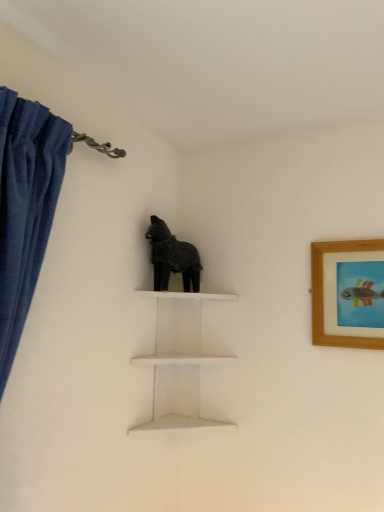
Question: Is the position of fuzzy black dog at center less distant than that of wooden framed picture at upper right?

Choices:
 (A) no
 (B) yes

Answer: (A)

Question: Considering the relative positions of fuzzy black dog at center and wooden framed picture at upper right in the image provided, is fuzzy black dog at center to the right of wooden framed picture at upper right from the viewer's perspective?

Choices:
 (A) no
 (B) yes

Answer: (A)

Question: From the image's perspective, is fuzzy black dog at center beneath wooden framed picture at upper right?

Choices:
 (A) no
 (B) yes

Answer: (A)

Question: Are fuzzy black dog at center and wooden framed picture at upper right located far from each other?

Choices:
 (A) yes
 (B) no

Answer: (B)

Question: Considering the relative sizes of fuzzy black dog at center and wooden framed picture at upper right in the image provided, is fuzzy black dog at center shorter than wooden framed picture at upper right?

Choices:
 (A) yes
 (B) no

Answer: (A)

Question: From their relative heights in the image, would you say wooden framed picture at upper right is taller or shorter than fuzzy black dog at center?

Choices:
 (A) short
 (B) tall

Answer: (B)

Question: Considering their positions, is wooden framed picture at upper right located in front of or behind fuzzy black dog at center?

Choices:
 (A) behind
 (B) front

Answer: (B)

Question: Is wooden framed picture at upper right spatially inside fuzzy black dog at center, or outside of it?

Choices:
 (A) inside
 (B) outside

Answer: (B)

Question: Considering the positions of point pos(342,323) and point pos(195,276), is point pos(342,323) closer or farther from the camera than point pos(195,276)?

Choices:
 (A) farther
 (B) closer

Answer: (B)

Question: Considering the positions of point (168, 250) and point (183, 366), is point (168, 250) closer or farther from the camera than point (183, 366)?

Choices:
 (A) farther
 (B) closer

Answer: (B)

Question: Considering the positions of fuzzy black dog at center and white matte shelf at center in the image, is fuzzy black dog at center taller or shorter than white matte shelf at center?

Choices:
 (A) short
 (B) tall

Answer: (A)

Question: From a real-world perspective, relative to white matte shelf at center, is fuzzy black dog at center vertically above or below?

Choices:
 (A) below
 (B) above

Answer: (B)

Question: Considering their positions, is fuzzy black dog at center located in front of or behind white matte shelf at center?

Choices:
 (A) front
 (B) behind

Answer: (B)

Question: Considering their positions, is white matte shelf at center located in front of or behind wooden framed picture at upper right?

Choices:
 (A) front
 (B) behind

Answer: (B)

Question: Based on their sizes in the image, would you say white matte shelf at center is bigger or smaller than wooden framed picture at upper right?

Choices:
 (A) big
 (B) small

Answer: (A)